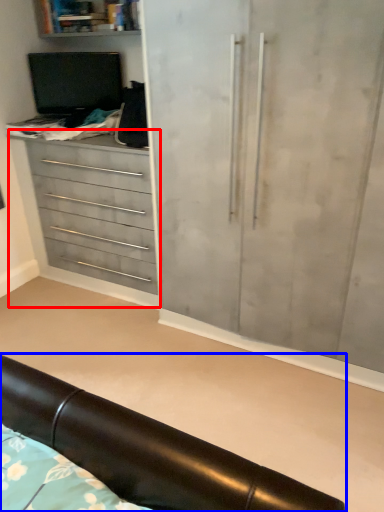
Question: Among these objects, which one is nearest to the camera, chest of drawers (highlighted by a red box) or furniture (highlighted by a blue box)?

Choices:
 (A) chest of drawers
 (B) furniture

Answer: (B)